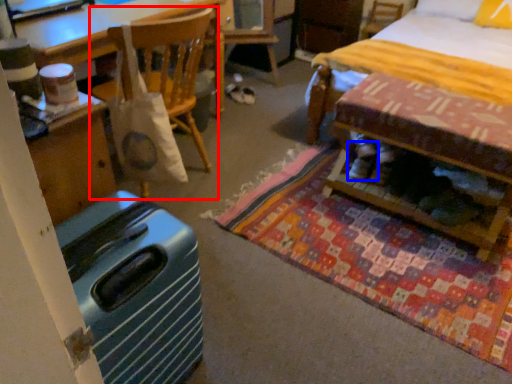
Question: Among these objects, which one is farthest to the camera, chair (highlighted by a red box) or footwear (highlighted by a blue box)?

Choices:
 (A) chair
 (B) footwear

Answer: (B)